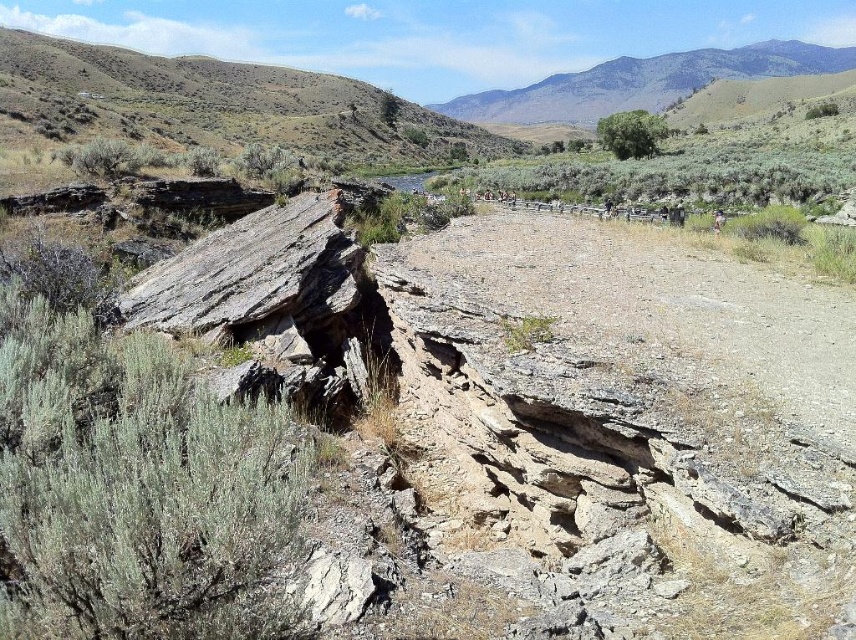
You are standing at the base of the landscape and looking upwards. Which object is positioned higher up between the gray rocky mountain at upper center and the green leafy tree at upper center?

The gray rocky mountain at upper center is positioned higher up than the green leafy tree at upper center according to the description.

You are hiking in this landscape and want to take a photo of both the gray rocky mountain at upper center and the green leafy tree at upper center. Which object should you position to your left side in the camera frame to include both in the shot?

You should position the green leafy tree at upper center to your left side in the camera frame because the gray rocky mountain at upper center is to the right of the green leafy tree at upper center.

You are standing at the base of the gray rocky mountain at upper center located at point (x=643, y=83). You want to climb to the top. Which direction should you move relative to the dense patch of low lying shrubs with silvery green foliage to your left?

You should move away from the dense patch of low lying shrubs with silvery green foliage to your left towards the gray rocky mountain at upper center located at point (x=643, y=83) to reach the top.